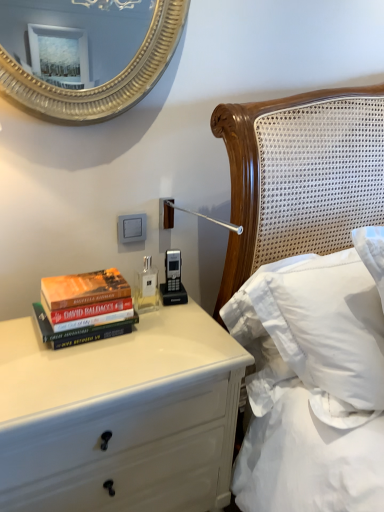
You are a GUI agent. You are given a task and a screenshot of the screen. Output one action in this format:
    pyautogui.click(x=<x>, y=<y>)
    Task: Click on the empty space that is ontop of hardcover books at left (from a real-world perspective)
    
    Given the screenshot: What is the action you would take?
    pyautogui.click(x=89, y=284)